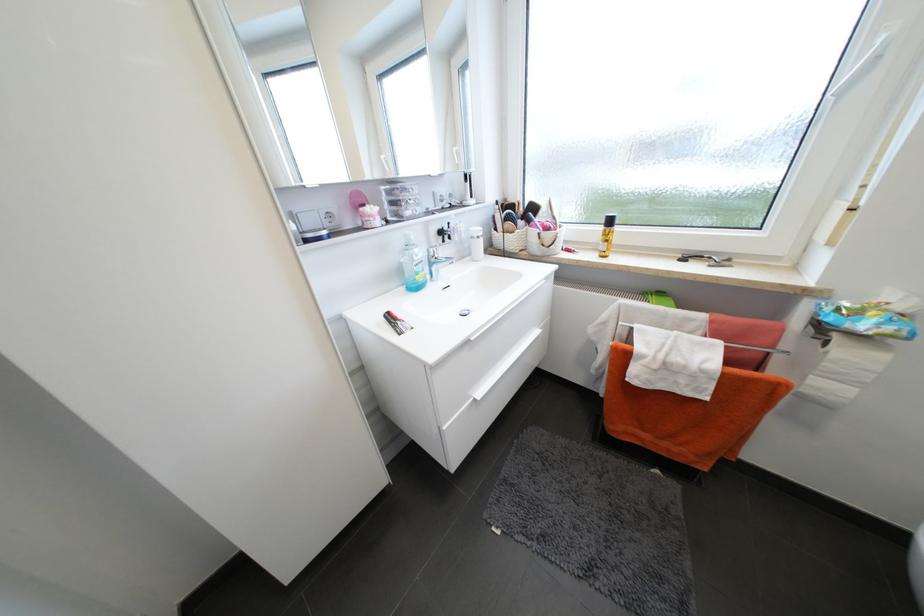
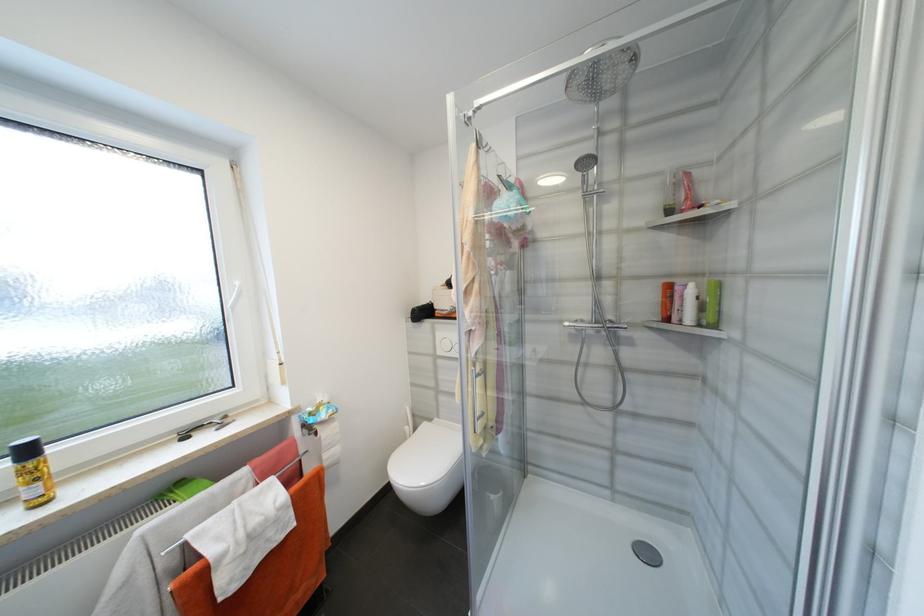
Find the pixel in the second image that matches [615,223] in the first image.

(33, 453)